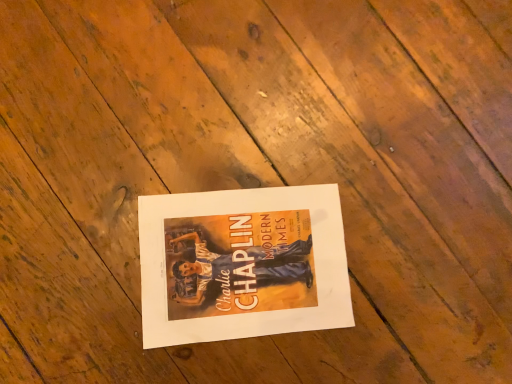
In order to click on vacant point to the right of matte paper poster at center in this screenshot , I will do `click(379, 311)`.